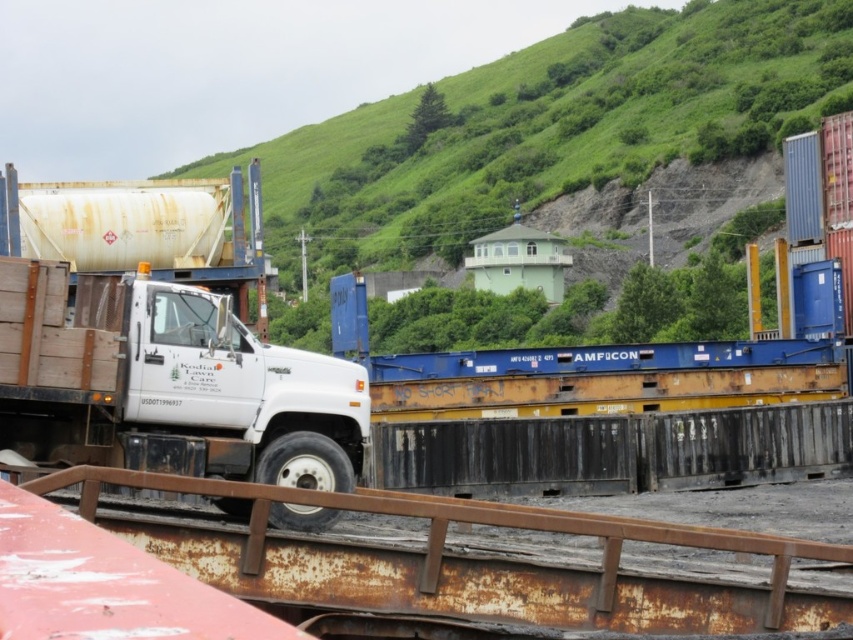
Is point (288, 148) more distant than point (409, 556)?

That is True.

The image size is (853, 640). What do you see at coordinates (548, 128) in the screenshot? I see `green grassy hillside at upper center` at bounding box center [548, 128].

Where is `green grassy hillside at upper center`? This screenshot has height=640, width=853. green grassy hillside at upper center is located at coordinates (548, 128).

Can you confirm if rusty metal rail at lower center is positioned to the left of white matte truck at center?

Incorrect, rusty metal rail at lower center is not on the left side of white matte truck at center.

Does rusty metal rail at lower center come behind white matte truck at center?

No, rusty metal rail at lower center is in front of white matte truck at center.

Measure the distance between point (329, 564) and camera.

11.73 meters

This screenshot has height=640, width=853. What are the coordinates of `rusty metal rail at lower center` in the screenshot? It's located at (471, 566).

At what (x,y) coordinates should I click in order to perform the action: click on green grassy hillside at upper center. Please return your answer as a coordinate pair (x, y). Looking at the image, I should click on (548, 128).